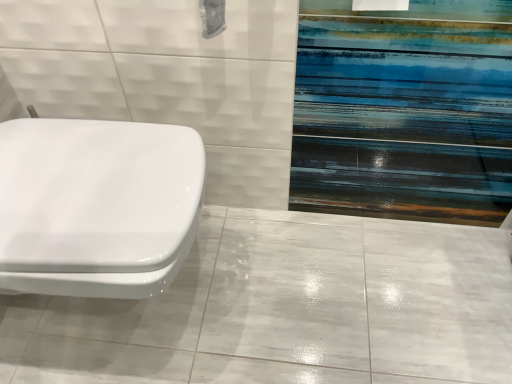
Question: Is white glossy tile at lower left wider or thinner than white glossy toilet at left?

Choices:
 (A) thin
 (B) wide

Answer: (B)

Question: From a real-world perspective, relative to white glossy toilet at left, is white glossy tile at lower left vertically above or below?

Choices:
 (A) above
 (B) below

Answer: (B)

Question: From the image's perspective, is white glossy tile at lower left positioned above or below white glossy toilet at left?

Choices:
 (A) above
 (B) below

Answer: (B)

Question: Is white glossy toilet at left inside or outside of white glossy tile at lower left?

Choices:
 (A) outside
 (B) inside

Answer: (A)

Question: From a real-world perspective, is white glossy toilet at left positioned above or below white glossy tile at lower left?

Choices:
 (A) below
 (B) above

Answer: (B)

Question: From the image's perspective, is white glossy toilet at left above or below white glossy tile at lower left?

Choices:
 (A) below
 (B) above

Answer: (B)

Question: Is white glossy toilet at left in front of or behind white glossy tile at lower left in the image?

Choices:
 (A) behind
 (B) front

Answer: (B)